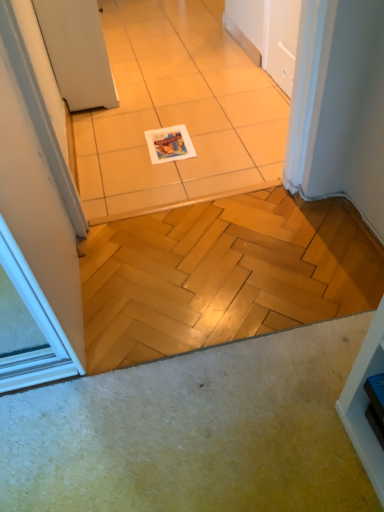
Question: From the image's perspective, would you say white glossy tile at center is shown under white glossy magazine at center?

Choices:
 (A) no
 (B) yes

Answer: (A)

Question: Is white glossy tile at center smaller than white glossy magazine at center?

Choices:
 (A) yes
 (B) no

Answer: (B)

Question: Are white glossy tile at center and white glossy magazine at center located far from each other?

Choices:
 (A) yes
 (B) no

Answer: (B)

Question: From a real-world perspective, is white glossy tile at center under white glossy magazine at center?

Choices:
 (A) yes
 (B) no

Answer: (A)

Question: Is white glossy tile at center taller than white glossy magazine at center?

Choices:
 (A) no
 (B) yes

Answer: (B)

Question: From the image's perspective, is white glossy magazine at center located above or below white glossy tile at center?

Choices:
 (A) above
 (B) below

Answer: (B)

Question: Based on their sizes in the image, would you say white glossy magazine at center is bigger or smaller than white glossy tile at center?

Choices:
 (A) big
 (B) small

Answer: (B)

Question: Considering the positions of white glossy magazine at center and white glossy tile at center in the image, is white glossy magazine at center wider or thinner than white glossy tile at center?

Choices:
 (A) thin
 (B) wide

Answer: (A)

Question: Which is correct: white glossy magazine at center is inside white glossy tile at center, or outside of it?

Choices:
 (A) inside
 (B) outside

Answer: (A)

Question: Based on their sizes in the image, would you say white matte door at upper left is bigger or smaller than white glossy magazine at center?

Choices:
 (A) big
 (B) small

Answer: (A)

Question: Is point (51, 5) positioned closer to the camera than point (158, 155)?

Choices:
 (A) closer
 (B) farther

Answer: (A)

Question: From a real-world perspective, is white matte door at upper left physically located above or below white glossy magazine at center?

Choices:
 (A) above
 (B) below

Answer: (A)

Question: In terms of height, does white matte door at upper left look taller or shorter compared to white glossy magazine at center?

Choices:
 (A) tall
 (B) short

Answer: (A)

Question: From a real-world perspective, relative to white glossy tile at center, is white matte door at upper left vertically above or below?

Choices:
 (A) below
 (B) above

Answer: (B)

Question: Based on their positions, is white matte door at upper left located to the left or right of white glossy tile at center?

Choices:
 (A) left
 (B) right

Answer: (A)